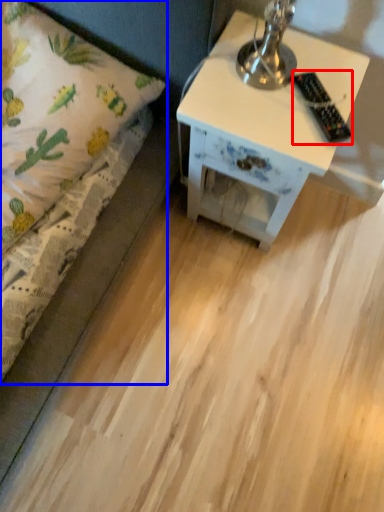
Question: Which object appears closest to the camera in this image, remote control (highlighted by a red box) or bed (highlighted by a blue box)?

Choices:
 (A) remote control
 (B) bed

Answer: (B)